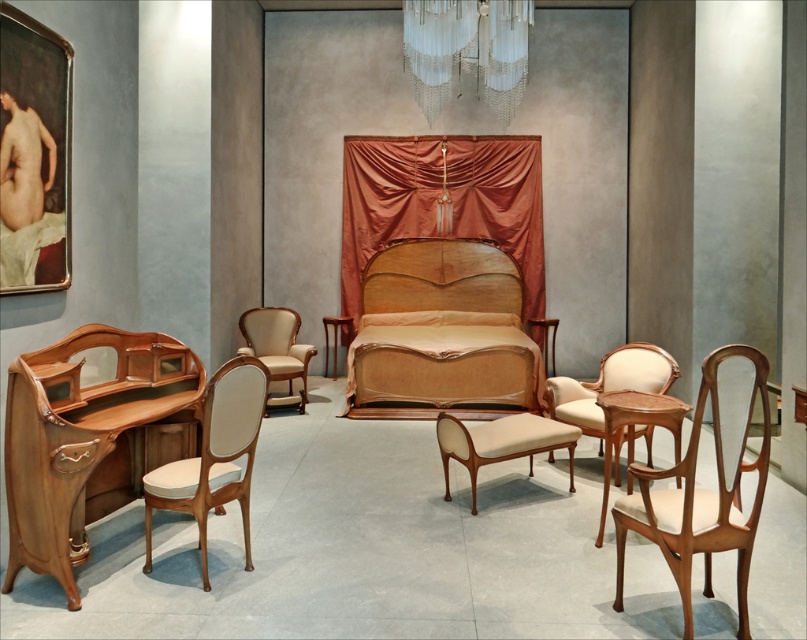
In the scene shown: Does wooden bed at center appear under light beige fabric armchair at center?

Yes, wooden bed at center is below light beige fabric armchair at center.

Who is higher up, wooden bed at center or light beige fabric armchair at center?

Positioned higher is light beige fabric armchair at center.

Locate an element on the screen. The height and width of the screenshot is (640, 807). wooden bed at center is located at coordinates (441, 333).

Can you confirm if light brown wood desk at lower left is bigger than matte cream armchair at center?

Yes.

Does point (111, 397) come farther from viewer compared to point (670, 384)?

That is False.

Locate an element on the screen. The width and height of the screenshot is (807, 640). light brown wood desk at lower left is located at coordinates (82, 438).

Does wooden bed at center appear over silky orange curtain at center?

No, wooden bed at center is not above silky orange curtain at center.

Is wooden bed at center to the left of silky orange curtain at center from the viewer's perspective?

Correct, you'll find wooden bed at center to the left of silky orange curtain at center.

Which is in front, point (412, 260) or point (479, 176)?

Point (479, 176) is in front.

Locate an element on the screen. Image resolution: width=807 pixels, height=640 pixels. wooden bed at center is located at coordinates (441, 333).